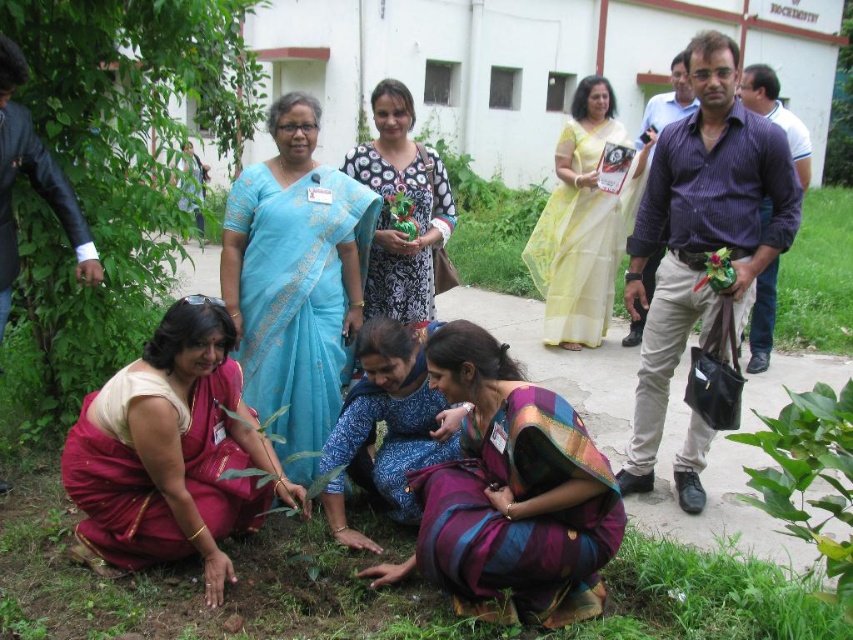
Question: Which of the following is the farthest from the observer?

Choices:
 (A) (572, 266)
 (B) (386, 300)
 (C) (712, 202)

Answer: (A)

Question: Which object is the farthest from the printed cotton dress at center?

Choices:
 (A) purple striped shirt at center
 (B) blue printed fabric at center
 (C) green leafy plant at lower left
 (D) yellow sheer saree at upper center

Answer: (D)

Question: From the image, what is the correct spatial relationship of green leafy plant at lower left in relation to purple silk saree at lower center?

Choices:
 (A) below
 (B) above

Answer: (B)

Question: Which object is positioned closest to the purple silk saree at lower center?

Choices:
 (A) blue silk saree at center
 (B) printed cotton dress at center
 (C) blue printed fabric at center
 (D) green leafy plant at lower right

Answer: (C)

Question: Is the position of blue printed fabric at center more distant than that of green leafy plant at lower right?

Choices:
 (A) yes
 (B) no

Answer: (A)

Question: Does yellow sheer saree at upper center have a greater width compared to blue printed fabric at center?

Choices:
 (A) yes
 (B) no

Answer: (A)